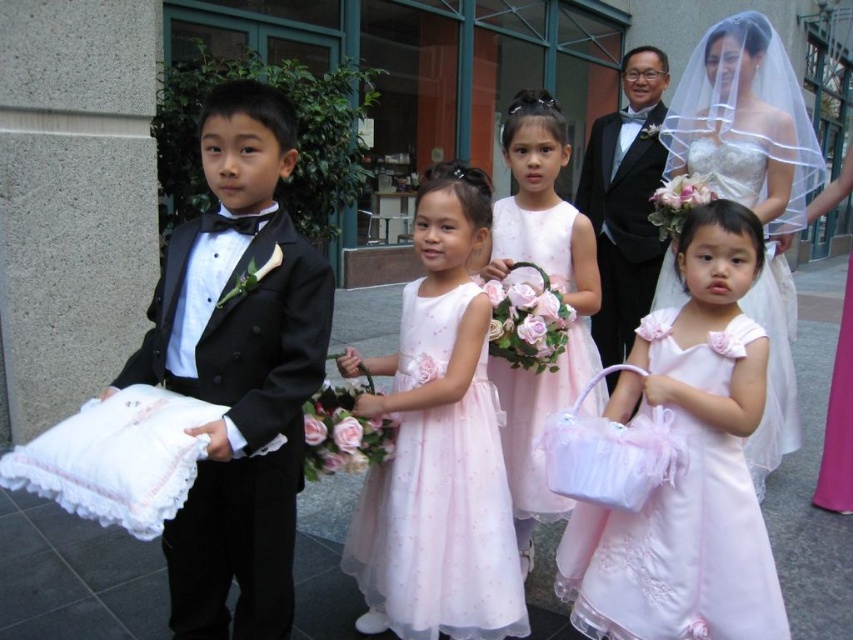
Question: Does pastel pink tulle dress at center lie in front of black satin tuxedo at center?

Choices:
 (A) no
 (B) yes

Answer: (B)

Question: Is satin white dress at upper center below black satin tuxedo at center?

Choices:
 (A) yes
 (B) no

Answer: (A)

Question: Is pink satin dress at lower right thinner than satin pink dress at center?

Choices:
 (A) no
 (B) yes

Answer: (A)

Question: Which of these objects is positioned closest to the satin pink dress at center?

Choices:
 (A) pastel pink tulle dress at center
 (B) pink satin dress at lower right

Answer: (A)

Question: Considering the real-world distances, which object is closest to the satin white dress at upper center?

Choices:
 (A) black satin tuxedo at center
 (B) satin pink dress at center
 (C) black satin tuxedo at left
 (D) pink satin dress at lower right

Answer: (A)

Question: Estimate the real-world distances between objects in this image. Which object is farther from the pink satin dress at lower right?

Choices:
 (A) satin white dress at upper center
 (B) pastel pink tulle dress at center
 (C) satin pink dress at center
 (D) black satin tuxedo at center

Answer: (D)